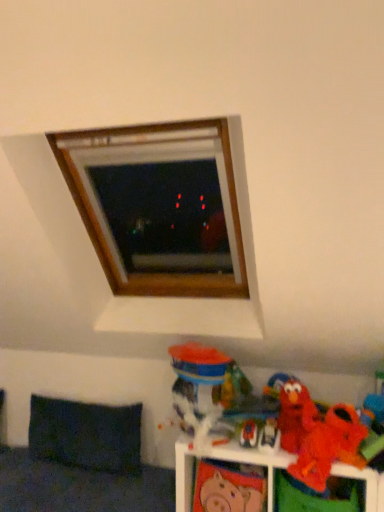
At what (x,y) coordinates should I click in order to perform the action: click on free space to the right of matte plastic elmo at lower right, the fourth toy positioned from the left. Please return your answer as a coordinate pair (x, y). The width and height of the screenshot is (384, 512). Looking at the image, I should click on (294, 452).